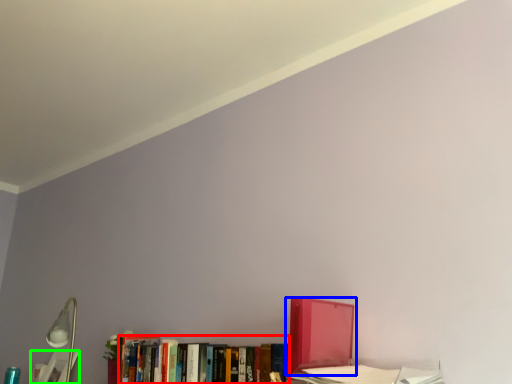
Question: Which object is the closest to the book (highlighted by a red box)? Choose among these: book (highlighted by a blue box) or book (highlighted by a green box).

Choices:
 (A) book
 (B) book

Answer: (A)